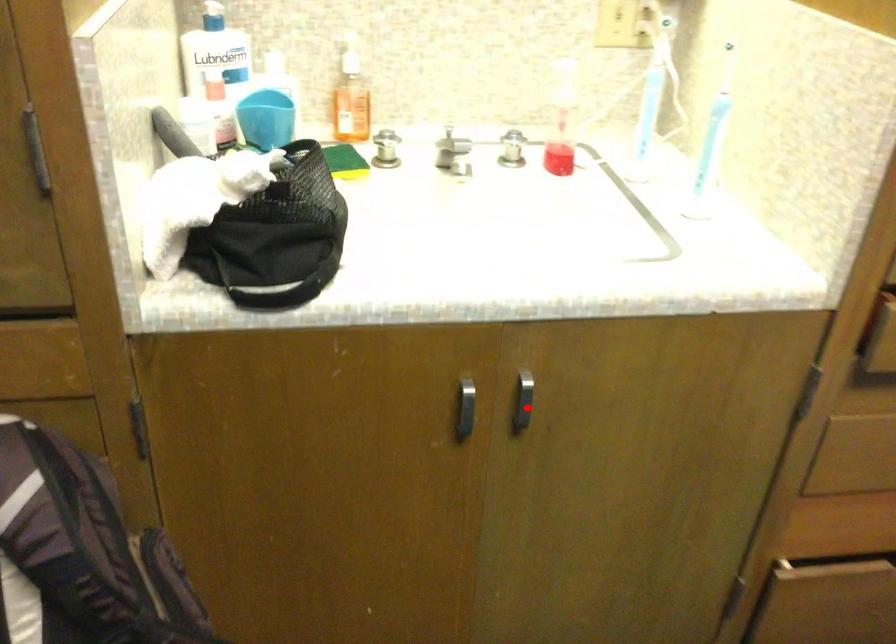
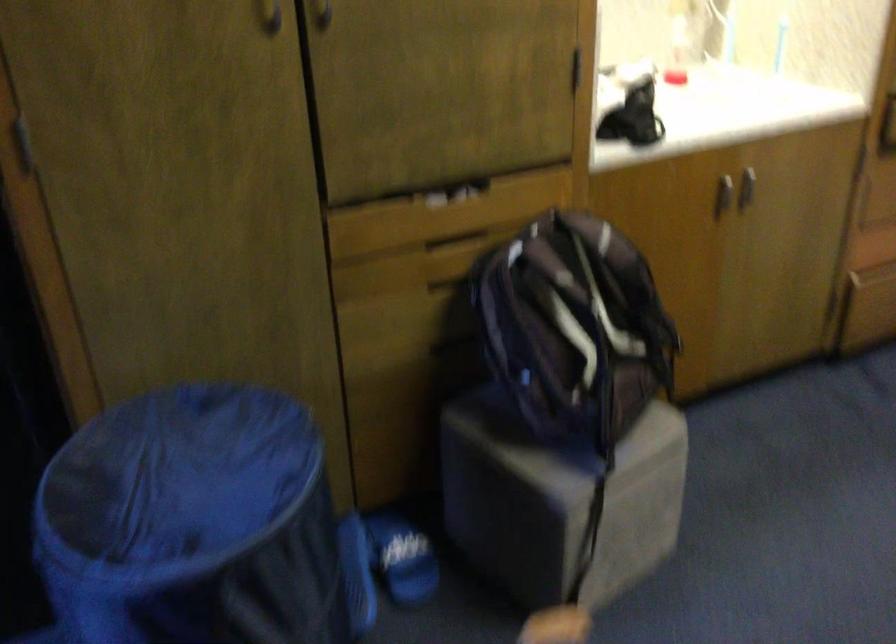
Question: I am providing you with two images of the same scene from different viewpoints. Given a red point in image1, look at the same physical point in image2. Is it:

Choices:
 (A) Closer to the viewpoint
 (B) Farther from the viewpoint

Answer: (B)